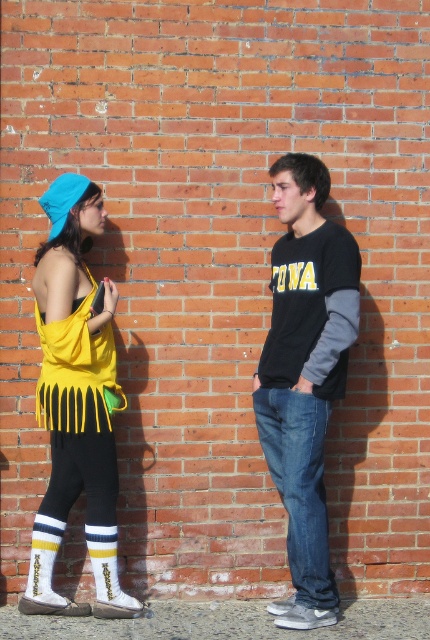
You are a photographer trying to capture a photo of both the black cotton shirt at center and the yellow fringe dress at left. Since you want them both in the frame, which direction should you move to ensure both are visible?

You should move to the left so that both the black cotton shirt at center and the yellow fringe dress at left are visible in the frame.

Consider the image. You are a photographer trying to capture a clear photo of both the yellow fringe tank top at left and the yellow fringe dress at left. Since the subjects are close to each other, will you be able to focus on both clearly in the same shot?

The yellow fringe dress at left is behind the yellow fringe tank top at left, so focusing on both clearly in the same shot may be challenging due to their layered positions.

You are a photographer setting up for a group photo. You need to position the black cotton shirt at center and the yellow fringe dress at left so that both are visible in the frame. Given their heights, which object should be placed closer to the camera to ensure both are fully visible?

The black cotton shirt at center is taller than the yellow fringe dress at left. To ensure both are fully visible in the frame, the yellow fringe dress at left should be placed closer to the camera.